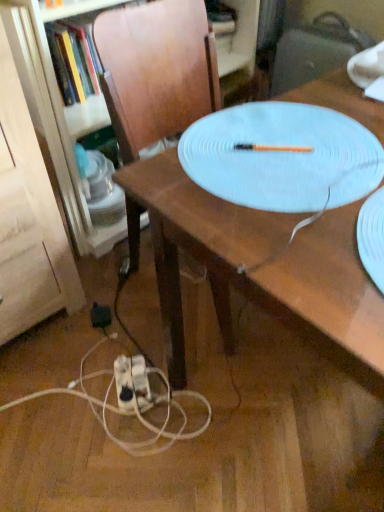
Where is `free space between white plastic extension cord at lower center and black plastic electric outlet at lower left`? free space between white plastic extension cord at lower center and black plastic electric outlet at lower left is located at coordinates (113, 348).